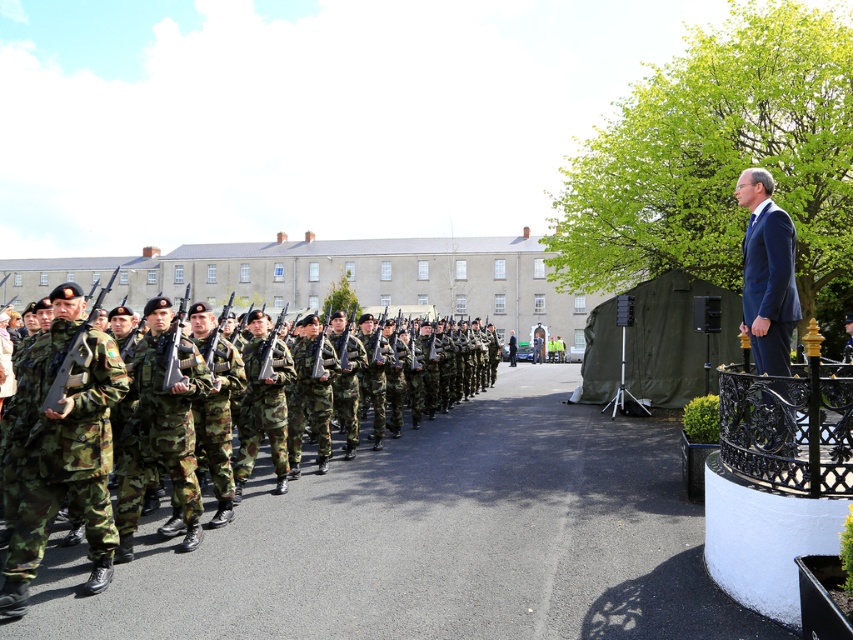
Question: From the image, what is the correct spatial relationship of camouflage fabric soldiers at left in relation to camouflage fabric uniform at left?

Choices:
 (A) right
 (B) left

Answer: (A)

Question: Can you confirm if camouflage fabric uniform at left is positioned to the left of dark blue suit at right?

Choices:
 (A) no
 (B) yes

Answer: (B)

Question: Which object is farther from the camera taking this photo?

Choices:
 (A) dark blue suit at right
 (B) camouflage fabric soldiers at left

Answer: (A)

Question: From the image, what is the correct spatial relationship of camouflage fabric uniform at left in relation to dark blue suit at right?

Choices:
 (A) above
 (B) below

Answer: (B)

Question: Among these objects, which one is farthest from the camera?

Choices:
 (A) camouflage fabric uniform at left
 (B) dark blue suit at right

Answer: (B)

Question: Among these objects, which one is nearest to the camera?

Choices:
 (A) dark blue suit at right
 (B) camouflage fabric soldiers at left

Answer: (B)